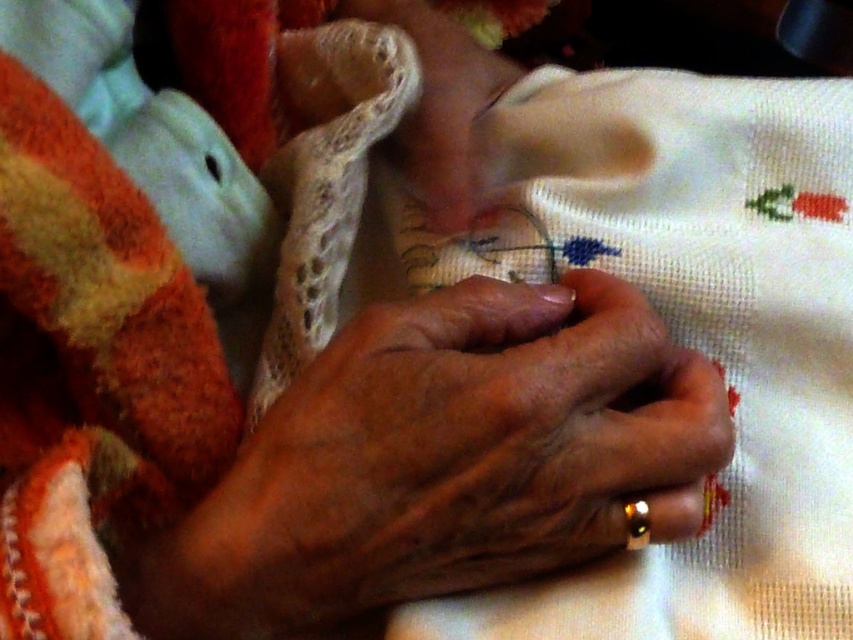
Question: Can you confirm if smooth skin hands at center is positioned above smooth beige hand at center?

Choices:
 (A) yes
 (B) no

Answer: (B)

Question: Among these points, which one is farthest from the camera?

Choices:
 (A) (244, 609)
 (B) (450, 80)

Answer: (B)

Question: Does smooth skin hands at center appear over smooth beige hand at center?

Choices:
 (A) no
 (B) yes

Answer: (A)

Question: Is smooth skin hands at center to the right of smooth beige hand at center from the viewer's perspective?

Choices:
 (A) no
 (B) yes

Answer: (A)